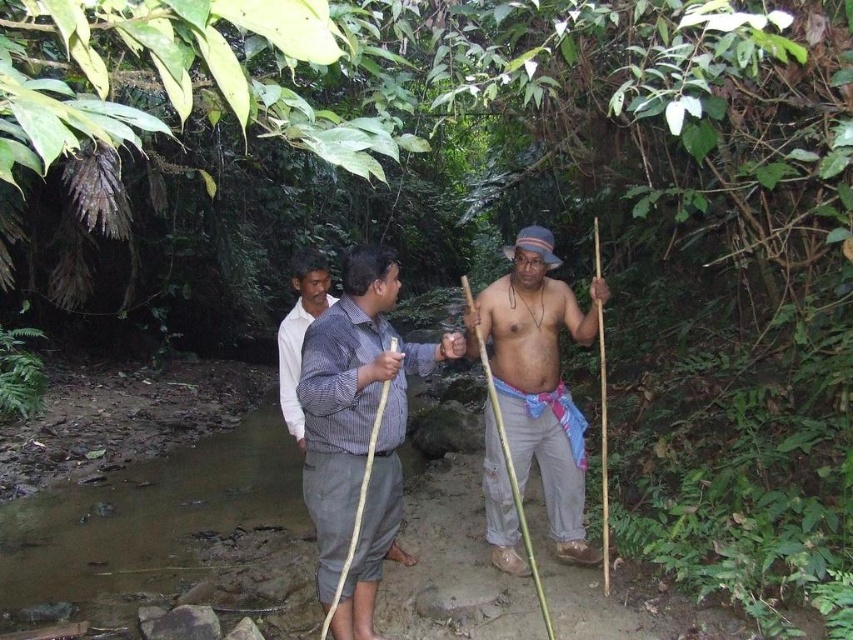
You are a hiker trying to identify objects in the scene. Which object is nearer to you between the checkered fabric shirt at center and the matte brown stick at center?

The checkered fabric shirt at center is closer to the viewer than the matte brown stick at center.

Looking at this image, you are trying to decide which object is larger between the checkered fabric shirt at center and the matte brown stick at center. Based on the scene, which one is bigger?

The checkered fabric shirt at center is smaller than the matte brown stick at center, so the matte brown stick at center is bigger.